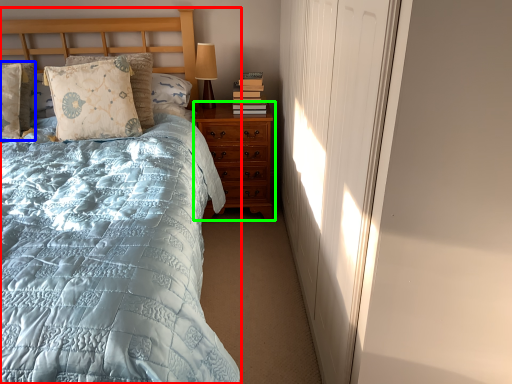
Question: Which is nearer to the bed (highlighted by a red box)? pillow (highlighted by a blue box) or nightstand (highlighted by a green box).

Choices:
 (A) pillow
 (B) nightstand

Answer: (B)